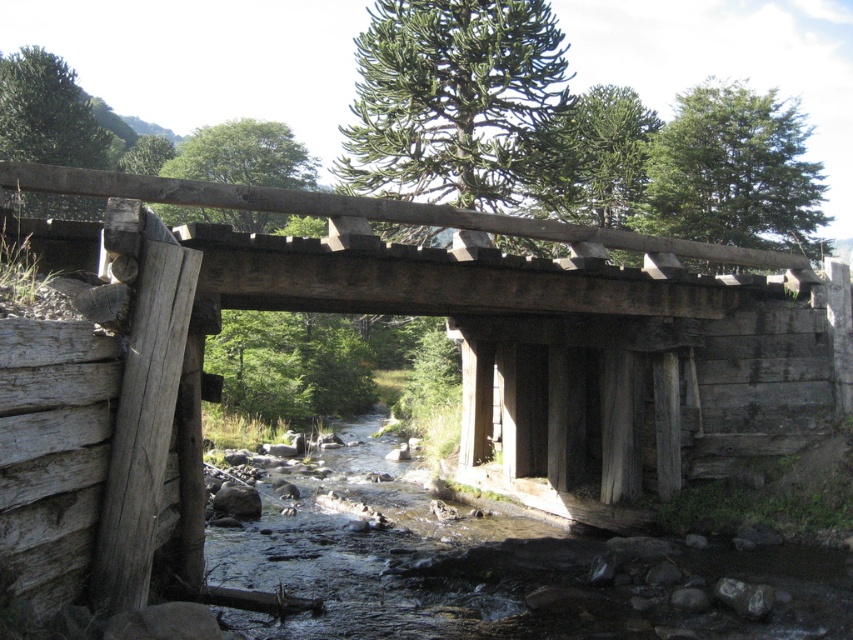
You are a hiker carrying a heavy backpack and need to cross the weathered wood bridge at center. The clear water at center flows beneath it. Which part of the crossing is narrower, the bridge or the water?

The weathered wood bridge at center is thinner than clear water at center, so the bridge is narrower than the water.

You are standing on the rustic wooden bridge and want to take a photo of both the point at coordinates (711, 326) and the point at coordinates (263, 518). Which point will appear larger in your camera view?

Point at coordinates (711, 326) will appear larger in the camera view because it is closer to the camera than point at coordinates (263, 518).